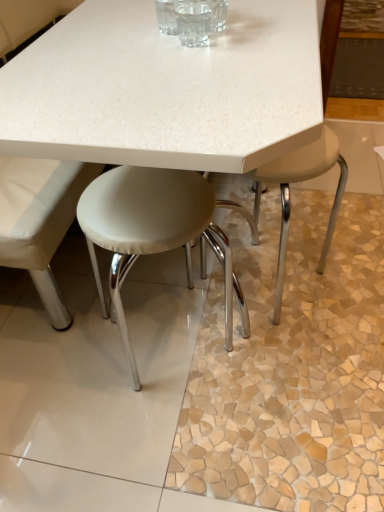
Where is `vacant space to the right of beige leather stool at lower right, acting as the second stool starting from the left`? vacant space to the right of beige leather stool at lower right, acting as the second stool starting from the left is located at coordinates (359, 295).